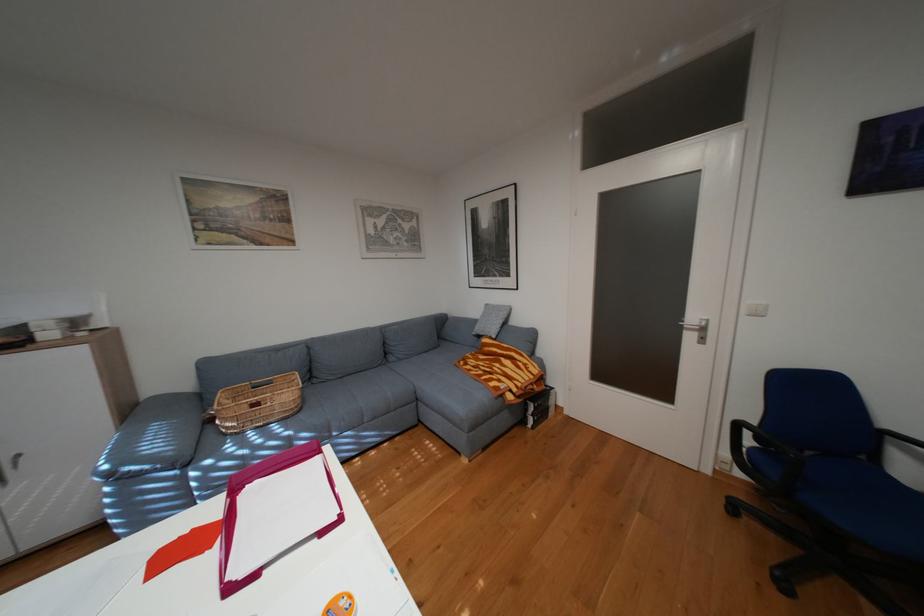
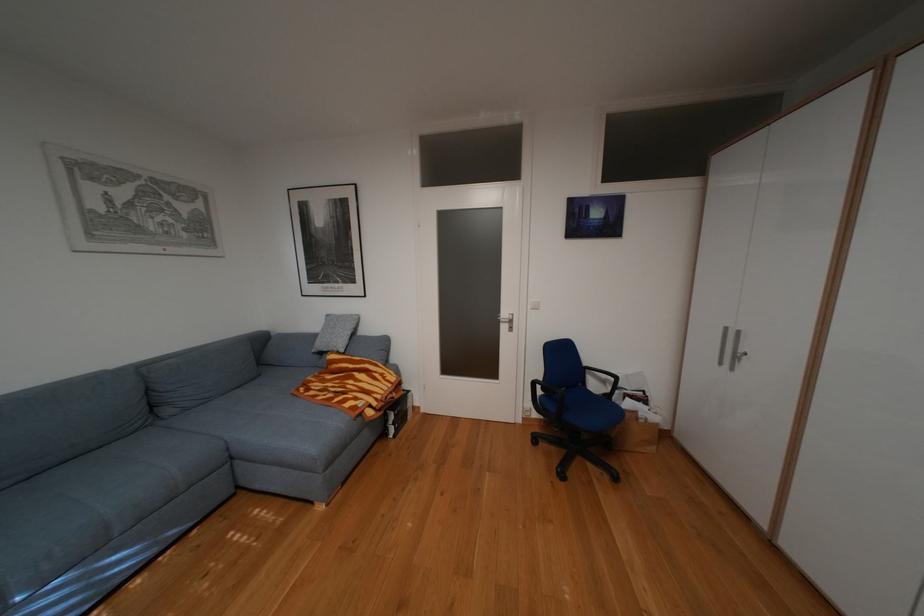
The point at (749, 424) is marked in the first image. Where is the corresponding point in the second image?

(545, 383)